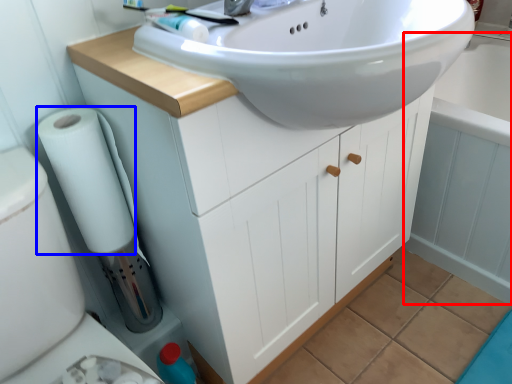
Question: Which of the following is the closest to the observer, bath (highlighted by a red box) or toilet paper (highlighted by a blue box)?

Choices:
 (A) bath
 (B) toilet paper

Answer: (B)